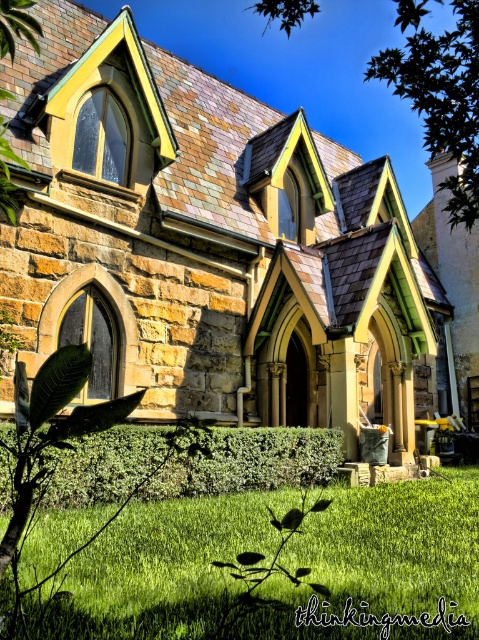
Is point (136, 104) positioned before point (458, 568)?

No.

Which is in front, point (288, 225) or point (137, 579)?

Positioned in front is point (137, 579).

What are the coordinates of `brown stone church at center` in the screenshot? It's located at (209, 244).

Is point (61, 556) positioned after point (451, 131)?

Yes, it is behind point (451, 131).

Between point (331, 506) and point (436, 97), which one is positioned in front?

Point (436, 97)

The width and height of the screenshot is (479, 640). What do you see at coordinates (381, 564) in the screenshot?
I see `green grass at lower center` at bounding box center [381, 564].

This screenshot has height=640, width=479. Identify the location of green grass at lower center. (381, 564).

Is point (294, 291) positioned in front of point (471, 12)?

No, (294, 291) is behind (471, 12).

Can you confirm if brown stone church at center is wider than green leafy tree at upper center?

Incorrect, brown stone church at center's width does not surpass green leafy tree at upper center's.

Locate an element on the screen. This screenshot has height=640, width=479. brown stone church at center is located at coordinates (209, 244).